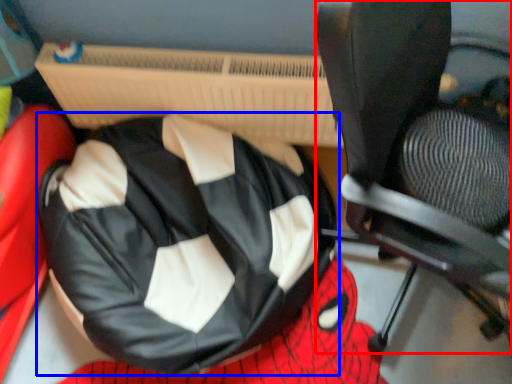
Question: Which object appears closest to the camera in this image, chair (highlighted by a red box) or bean bag chair (highlighted by a blue box)?

Choices:
 (A) chair
 (B) bean bag chair

Answer: (A)